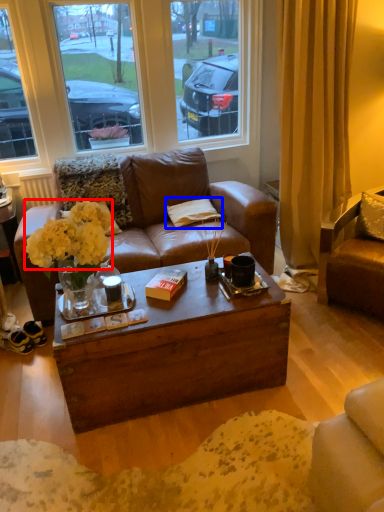
Question: Which object is further to the camera taking this photo, flower (highlighted by a red box) or pillow (highlighted by a blue box)?

Choices:
 (A) flower
 (B) pillow

Answer: (B)